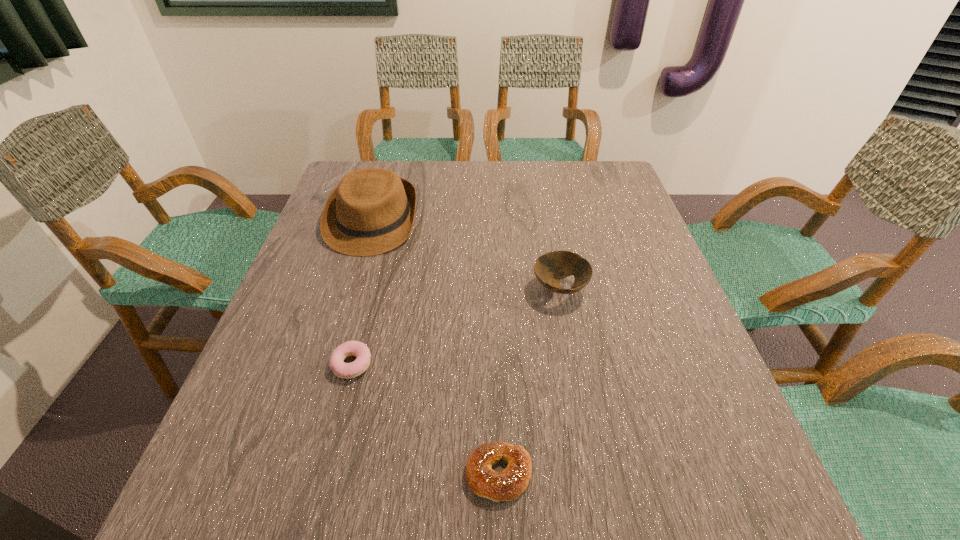
Where is `free space at the near right corner`? Image resolution: width=960 pixels, height=540 pixels. free space at the near right corner is located at coordinates [x=709, y=498].

The height and width of the screenshot is (540, 960). Find the location of `free spot between the second nearest object and the farthest object`. free spot between the second nearest object and the farthest object is located at coordinates (362, 293).

The width and height of the screenshot is (960, 540). Identify the location of vacant area that lies between the rightmost object and the third object from left to right. coord(529,382).

The width and height of the screenshot is (960, 540). What are the coordinates of `free space between the fedora and the bagel` in the screenshot? It's located at (436, 348).

I want to click on free spot between the doughnut and the third nearest object, so click(x=456, y=327).

Locate an element on the screen. free point between the second tallest object and the doughnut is located at coordinates (456, 327).

Identify the location of free area in between the third nearest object and the fedora. The height and width of the screenshot is (540, 960). (467, 255).

Find the location of `vacant area that lies between the rightmost object and the tallest object`. vacant area that lies between the rightmost object and the tallest object is located at coordinates (467, 255).

You are a GUI agent. You are given a task and a screenshot of the screen. Output one action in this format:
    pyautogui.click(x=<x>, y=<y>)
    Task: Click on the free point between the rightmost object and the second object from right to left
    
    Given the screenshot: What is the action you would take?
    pyautogui.click(x=529, y=382)

At what (x,y) coordinates should I click in order to perform the action: click on blank region between the nearest object and the tallest object. Please return your answer as a coordinate pair (x, y). Looking at the image, I should click on (436, 348).